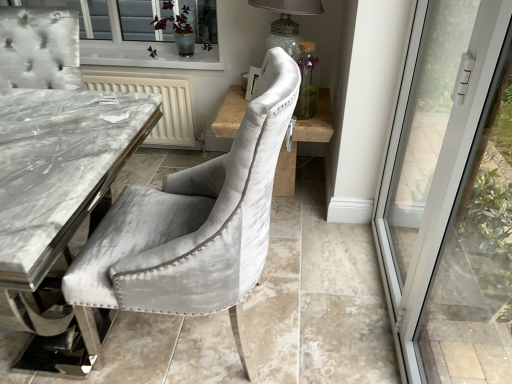
Where is `free area below transparent glass door at right (from a real-world perspective)`? The height and width of the screenshot is (384, 512). free area below transparent glass door at right (from a real-world perspective) is located at coordinates (380, 297).